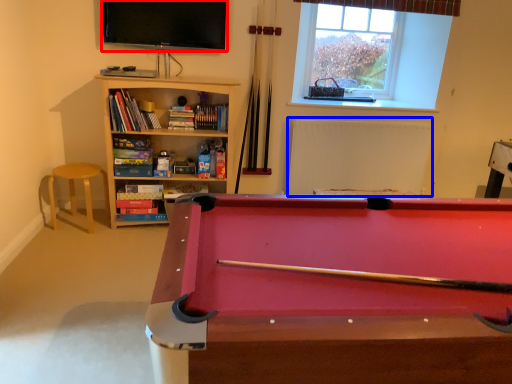
Question: Among these objects, which one is nearest to the camera, television (highlighted by a red box) or radiator (highlighted by a blue box)?

Choices:
 (A) television
 (B) radiator

Answer: (A)